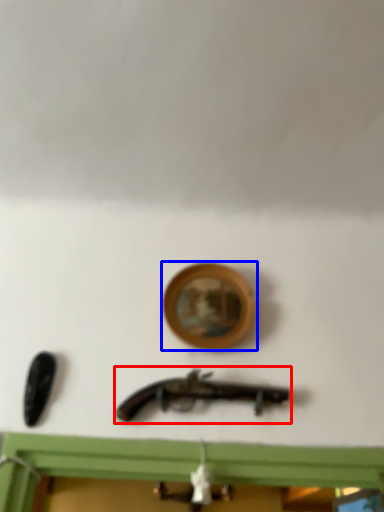
Question: Which of the following is the closest to the observer, weapon (highlighted by a red box) or picture frame (highlighted by a blue box)?

Choices:
 (A) weapon
 (B) picture frame

Answer: (A)